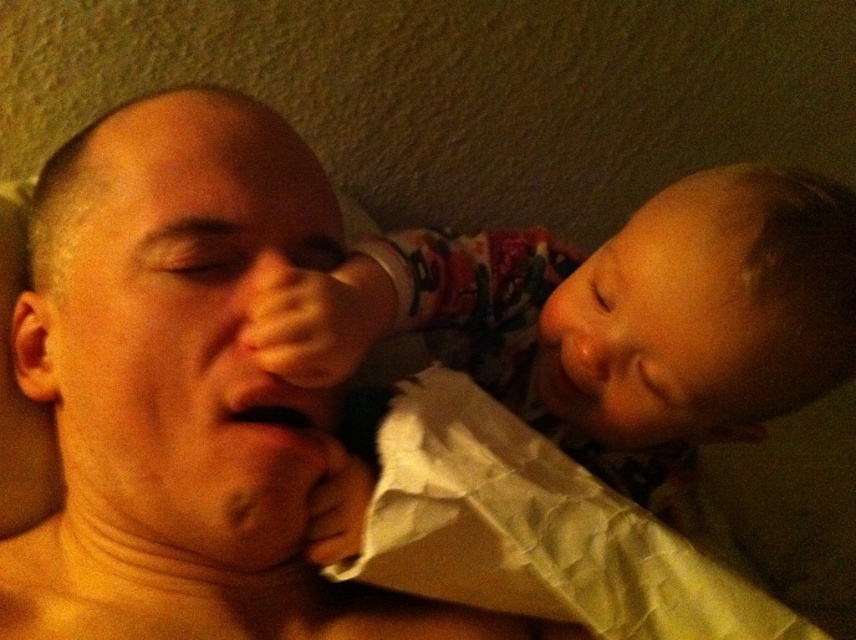
You are organizing a laundry day and need to sort items by size. You have a skinny white shirt at center and a white crumpled paper at lower center. Which item should you place in the larger laundry basket if you want to sort by size?

The skinny white shirt at center should be placed in the larger laundry basket because it might be wider than the white crumpled paper at lower center.

You are holding a 15 inch long toy that needs to be placed on the soft pink fabric at upper right. Can the toy fit on the fabric without hanging off the edge?

The soft pink fabric at upper right is 17.10 inches from camera. Since the toy is 15 inches long, it can fit on the fabric as it is shorter than the fabric length.

You are taking a photo of two people in a dimly lit room. You notice two points in the image labeled as point (43, 586) and point (815, 627). Which point is closer to the camera?

Point (43, 586) is closer to the camera than point (815, 627).